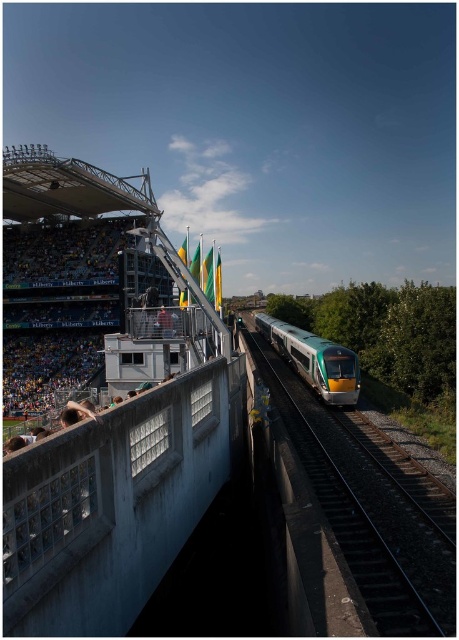
Who is shorter, green metallic train track at center or green metallic train at center?

green metallic train track at center

Who is positioned more to the right, green metallic train track at center or green metallic train at center?

green metallic train at center is more to the right.

Locate an element on the screen. green metallic train track at center is located at coordinates (367, 509).